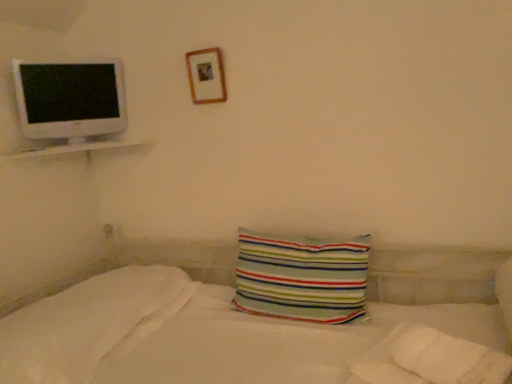
Question: From a real-world perspective, does white glossy shelf at upper left sit lower than wooden picture frame at upper center?

Choices:
 (A) no
 (B) yes

Answer: (B)

Question: Is white glossy shelf at upper left turned away from wooden picture frame at upper center?

Choices:
 (A) yes
 (B) no

Answer: (B)

Question: Does white glossy shelf at upper left come in front of wooden picture frame at upper center?

Choices:
 (A) yes
 (B) no

Answer: (A)

Question: Does white glossy shelf at upper left appear on the left side of wooden picture frame at upper center?

Choices:
 (A) no
 (B) yes

Answer: (B)

Question: Can you confirm if white glossy shelf at upper left is thinner than wooden picture frame at upper center?

Choices:
 (A) no
 (B) yes

Answer: (A)

Question: Considering the positions of point (348, 314) and point (216, 71), is point (348, 314) closer or farther from the camera than point (216, 71)?

Choices:
 (A) farther
 (B) closer

Answer: (B)

Question: Is striped fabric pillow at center, which ranks as the second pillow in left-to-right order, taller or shorter than wooden picture frame at upper center?

Choices:
 (A) short
 (B) tall

Answer: (B)

Question: In terms of size, does striped fabric pillow at center, placed as the first pillow when sorted from right to left, appear bigger or smaller than wooden picture frame at upper center?

Choices:
 (A) big
 (B) small

Answer: (A)

Question: Looking at their shapes, would you say striped fabric pillow at center, which ranks as the second pillow in left-to-right order, is wider or thinner than wooden picture frame at upper center?

Choices:
 (A) thin
 (B) wide

Answer: (B)

Question: From the image's perspective, is wooden picture frame at upper center above or below white glossy shelf at upper left?

Choices:
 (A) above
 (B) below

Answer: (A)

Question: Looking at the image, does wooden picture frame at upper center seem bigger or smaller compared to white glossy shelf at upper left?

Choices:
 (A) small
 (B) big

Answer: (A)

Question: From a real-world perspective, is wooden picture frame at upper center physically located above or below white glossy shelf at upper left?

Choices:
 (A) above
 (B) below

Answer: (A)

Question: Considering their positions, is wooden picture frame at upper center located in front of or behind white glossy shelf at upper left?

Choices:
 (A) front
 (B) behind

Answer: (B)

Question: Looking at their shapes, would you say white soft pillow at lower left, the 2th pillow viewed from the right, is wider or thinner than white glossy computer monitor at upper left?

Choices:
 (A) wide
 (B) thin

Answer: (A)

Question: From a real-world perspective, is white soft pillow at lower left, which is the 1th pillow from left to right, positioned above or below white glossy computer monitor at upper left?

Choices:
 (A) above
 (B) below

Answer: (B)